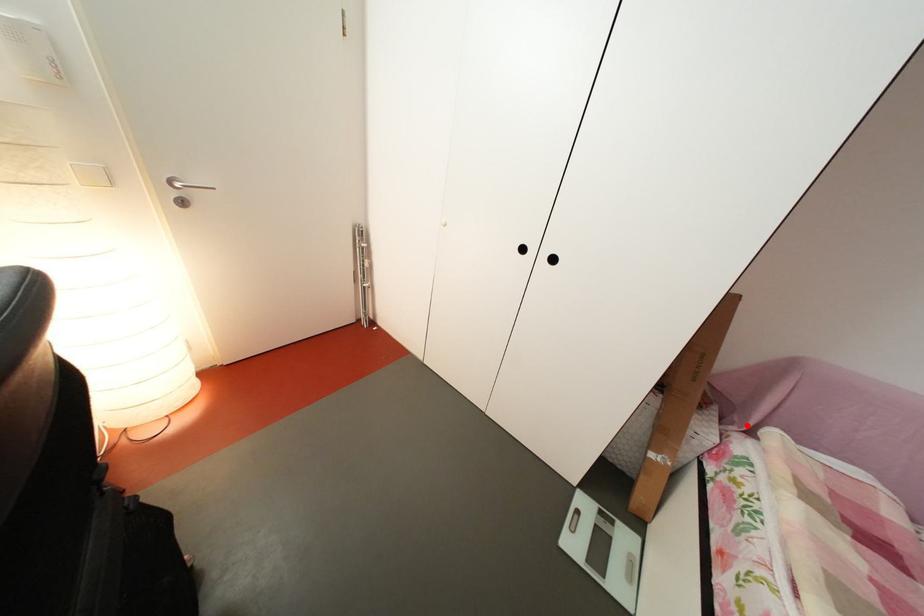
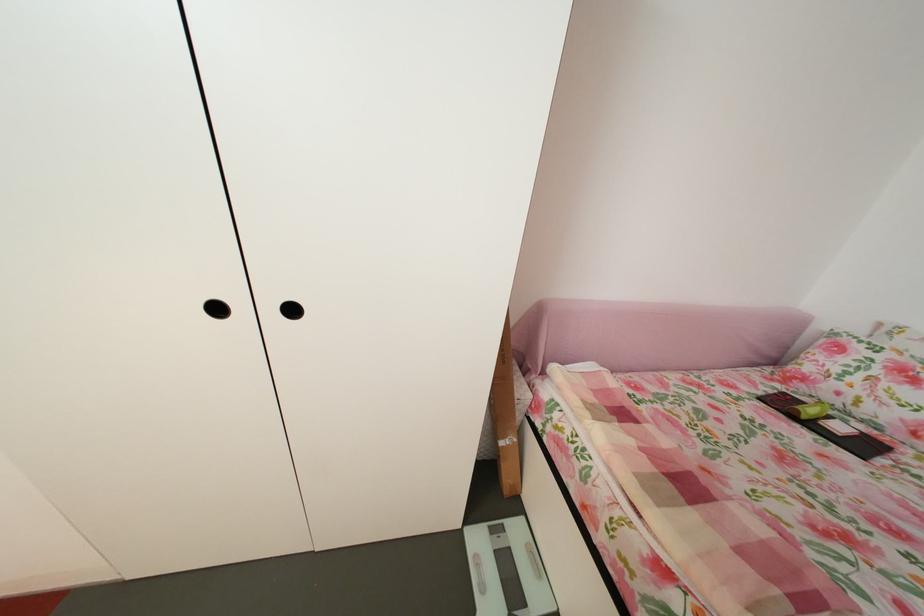
In the second image, find the point that corresponds to the highlighted location in the first image.

(541, 371)